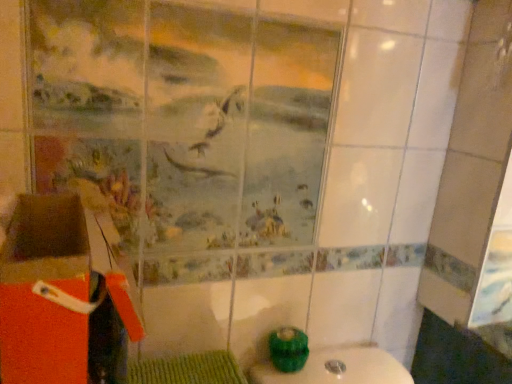
Question: Is point (23, 253) closer or farther from the camera than point (268, 334)?

Choices:
 (A) closer
 (B) farther

Answer: (A)

Question: From their relative heights in the image, would you say orange cardboard box at lower left is taller or shorter than teal glossy toilet bowl at lower center?

Choices:
 (A) short
 (B) tall

Answer: (B)

Question: Visually, is orange cardboard box at lower left positioned to the left or to the right of teal glossy toilet bowl at lower center?

Choices:
 (A) left
 (B) right

Answer: (A)

Question: Visually, is teal glossy toilet bowl at lower center positioned to the left or to the right of orange cardboard box at lower left?

Choices:
 (A) left
 (B) right

Answer: (B)

Question: Considering the positions of point 278,360 and point 56,324, is point 278,360 closer or farther from the camera than point 56,324?

Choices:
 (A) closer
 (B) farther

Answer: (B)

Question: From their relative heights in the image, would you say teal glossy toilet bowl at lower center is taller or shorter than orange cardboard box at lower left?

Choices:
 (A) tall
 (B) short

Answer: (B)

Question: Considering the positions of teal glossy toilet bowl at lower center and orange cardboard box at lower left in the image, is teal glossy toilet bowl at lower center bigger or smaller than orange cardboard box at lower left?

Choices:
 (A) big
 (B) small

Answer: (B)